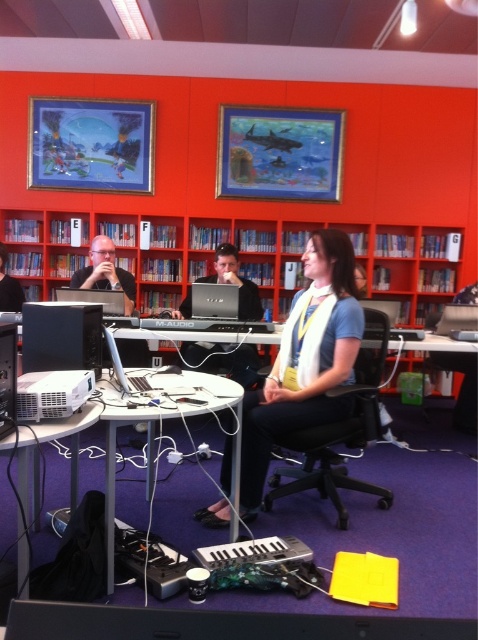
Does matte black laptop at center have a greater height compared to silver/black laptop at center?

Indeed, matte black laptop at center has a greater height compared to silver/black laptop at center.

Does matte black laptop at center appear over silver/black laptop at center?

Actually, matte black laptop at center is below silver/black laptop at center.

What do you see at coordinates (224, 360) in the screenshot?
I see `matte black laptop at center` at bounding box center [224, 360].

At what (x,y) coordinates should I click in order to perform the action: click on matte black laptop at center. Please return your answer as a coordinate pair (x, y). The height and width of the screenshot is (640, 478). Looking at the image, I should click on (224, 360).

How distant is black plastic table at lower left from matte black laptop at center?

2.04 meters

The image size is (478, 640). Describe the element at coordinates (40, 474) in the screenshot. I see `black plastic table at lower left` at that location.

Between point (41, 429) and point (243, 358), which one is positioned behind?

The point (243, 358) is behind.

Image resolution: width=478 pixels, height=640 pixels. I want to click on black plastic table at lower left, so click(40, 474).

Looking at this image, can you confirm if red plastic bookcase at center is positioned below silver/black laptop at center?

Actually, red plastic bookcase at center is above silver/black laptop at center.

Is red plastic bookcase at center smaller than silver/black laptop at center?

No, red plastic bookcase at center is not smaller than silver/black laptop at center.

Who is more forward, (x=145, y=218) or (x=218, y=301)?

Positioned in front is point (x=218, y=301).

At what (x,y) coordinates should I click in order to perform the action: click on red plastic bookcase at center. Please return your answer as a coordinate pair (x, y). The height and width of the screenshot is (640, 478). Looking at the image, I should click on (154, 252).